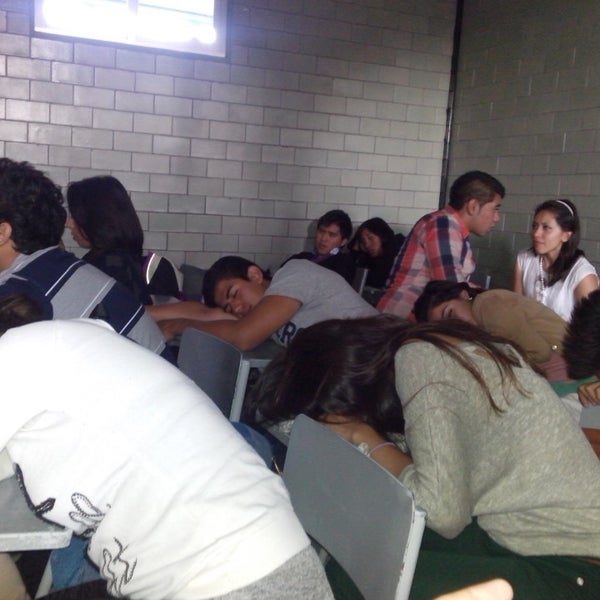
Identify the location of window sill. (192, 49).